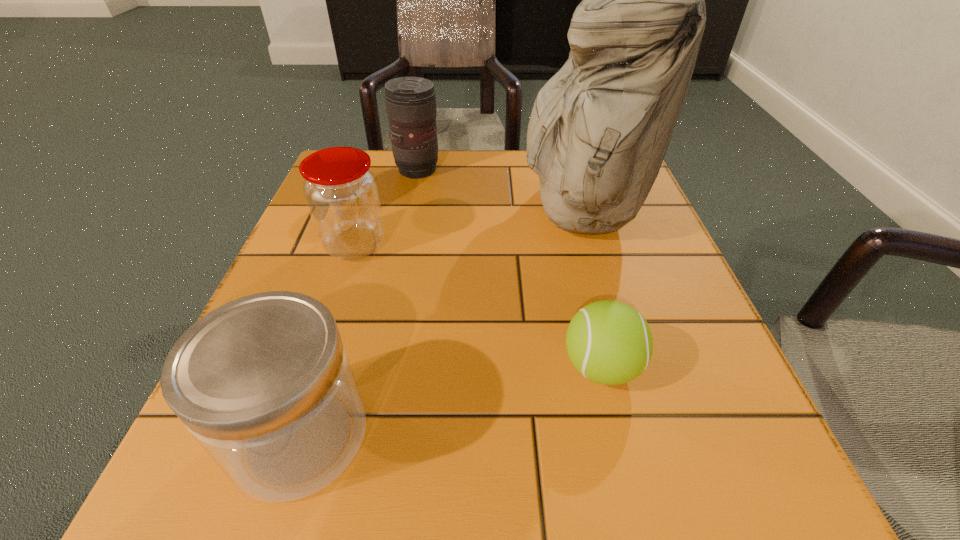
What are the coordinates of `the tallest object` in the screenshot? It's located at (600, 127).

Locate an element on the screen. telephoto lens is located at coordinates (410, 102).

I want to click on the farther jar, so click(341, 191).

Identify the location of the nearer jar. The image size is (960, 540). pyautogui.click(x=264, y=384).

Image resolution: width=960 pixels, height=540 pixels. In order to click on tennis ball in this screenshot , I will do `click(609, 342)`.

I want to click on vacant space situated on the front-facing side of the tallest object, so click(365, 209).

The height and width of the screenshot is (540, 960). What are the coordinates of `blank space located on the front-facing side of the tallest object` in the screenshot? It's located at (384, 209).

Image resolution: width=960 pixels, height=540 pixels. Identify the location of free space located on the front-facing side of the tallest object. (451, 209).

Image resolution: width=960 pixels, height=540 pixels. What are the coordinates of `free space located 0.160m on the side of the telephoto lens where the control switches are located` in the screenshot? It's located at (509, 170).

I want to click on blank space located on the front of the farther jar, so click(x=305, y=394).